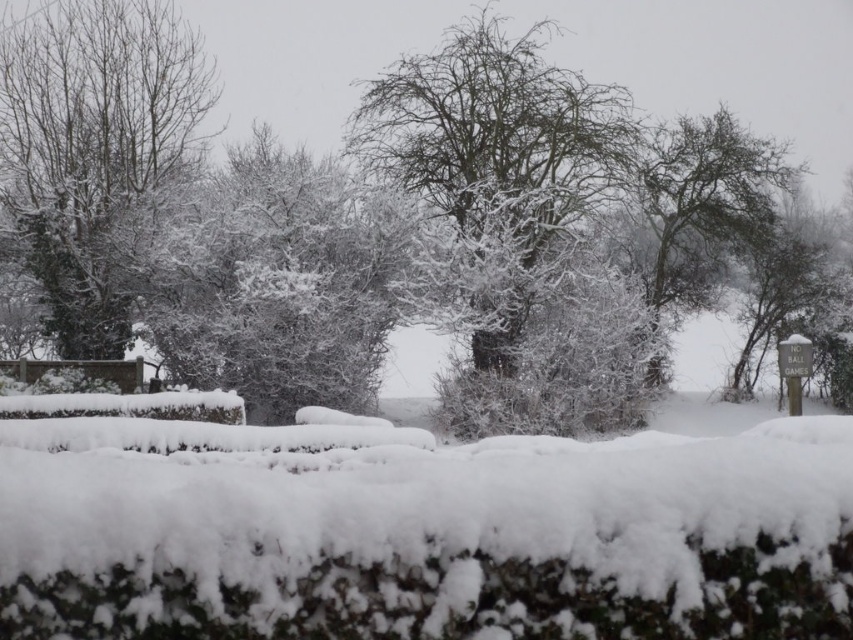
Question: Does white fluffy hedge at center appear on the right side of snow-covered branches at center?

Choices:
 (A) yes
 (B) no

Answer: (B)

Question: Is snow-covered tree at left to the right of snow-covered branches at center from the viewer's perspective?

Choices:
 (A) yes
 (B) no

Answer: (B)

Question: Among these objects, which one is nearest to the camera?

Choices:
 (A) snow-covered tree at left
 (B) snow-covered branches at center
 (C) snow-covered tree at center
 (D) white fluffy hedge at center

Answer: (D)

Question: Considering the real-world distances, which object is farthest from the snow-covered tree at left?

Choices:
 (A) snow-covered branches at center
 (B) white fluffy hedge at center

Answer: (B)

Question: Which point is closer to the camera taking this photo?

Choices:
 (A) [775, 150]
 (B) [717, 438]
 (C) [492, 124]

Answer: (B)

Question: Can you confirm if snow-covered tree at left is bigger than snow-covered tree at center?

Choices:
 (A) yes
 (B) no

Answer: (B)